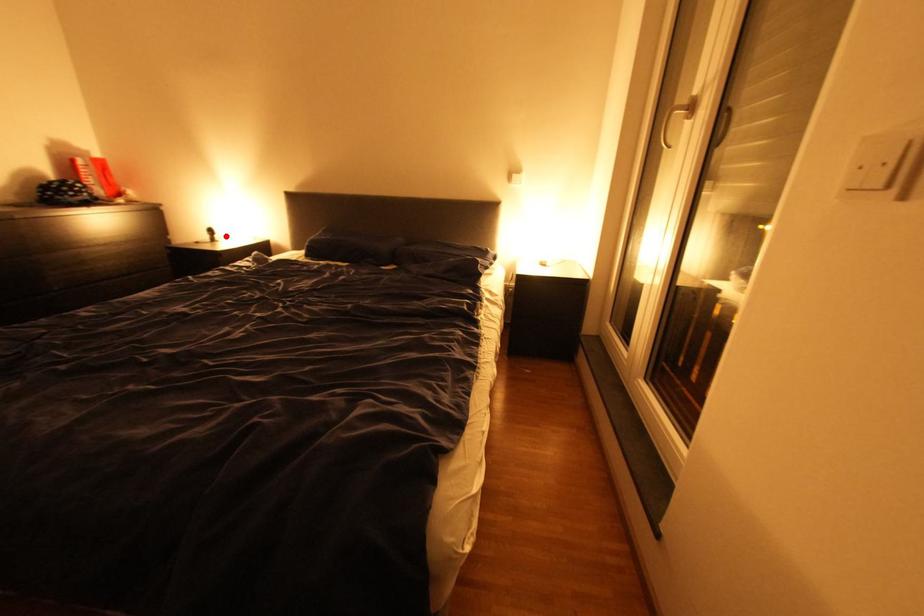
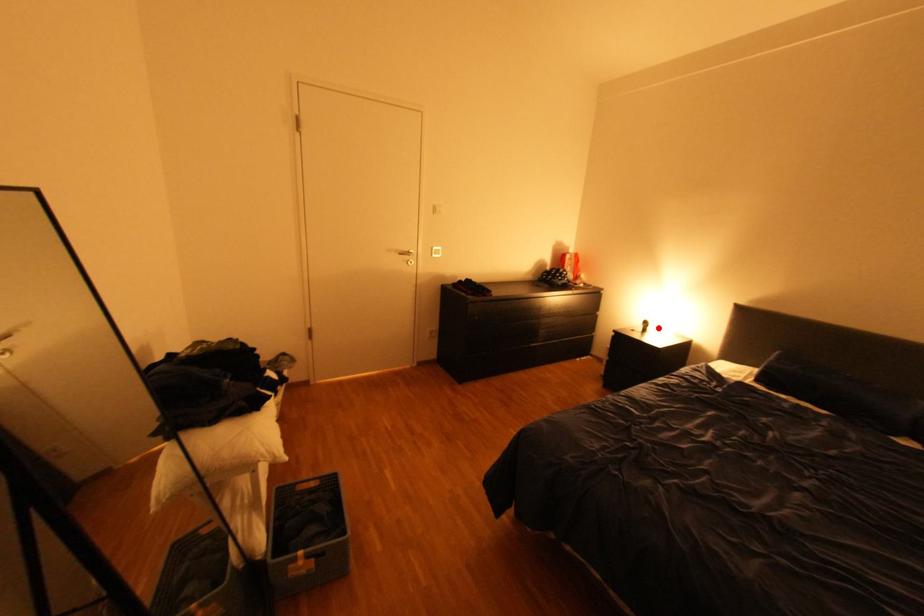
I am providing you with two images of the same scene from different viewpoints. A red point is marked on the first image and another point is marked on the second image. Is the red point in image1 aligned with the point shown in image2?

Yes